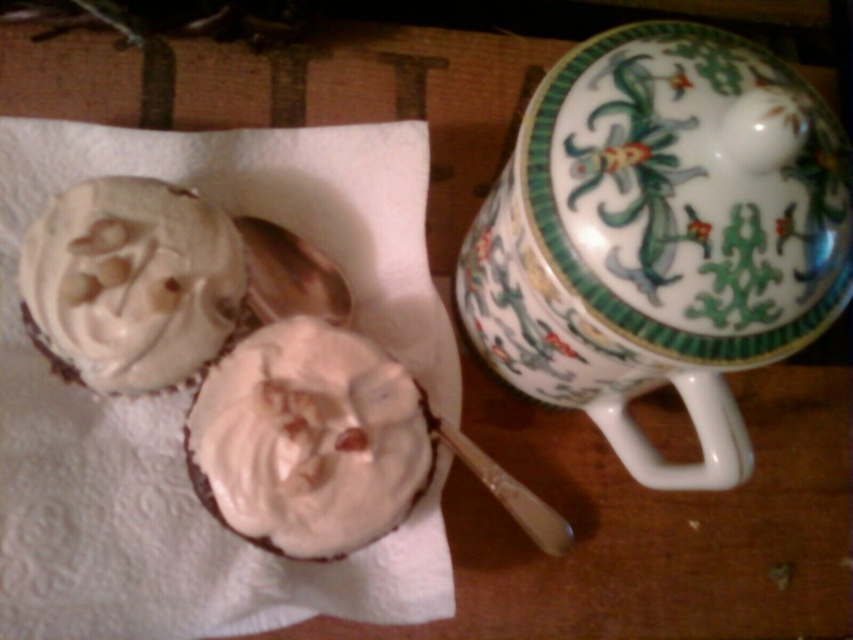
You are trying to grab the whipped cream cupcake at left but there is a porcelain mug with floral design at upper center in the way. Can you reach the cupcake without moving the mug?

The porcelain mug with floral design at upper center is closer to the viewer than the whipped cream cupcake at left, so the mug is blocking the path to the cupcake. You would need to move the mug to reach the cupcake.

You are standing in front of the cupcakes and the decorative ceramic container. There are two points marked on the image, one at coordinate point (x=776, y=164) and another at point (x=167, y=212). Which of these two points is closer to you?

Point (x=776, y=164) is closer to the viewer than point (x=167, y=212).

You are trying to place a new cupcake on the wooden surface near the porcelain mug with floral design at upper center. What are the coordinates where you should place it?

The porcelain mug with floral design at upper center is located at coordinates (660, 236), so you should place the new cupcake near those coordinates.